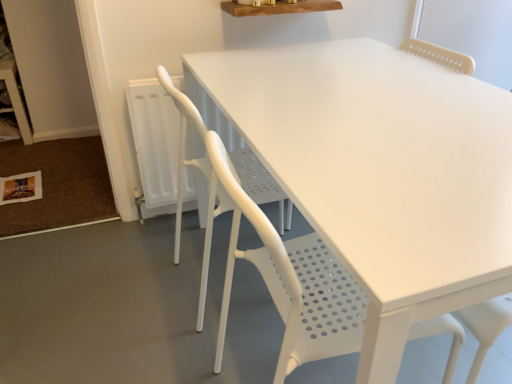
Question: From the image's perspective, is white matte chair at center, the 2th chair from the back, above or below white perforated chair at center, positioned as the second chair in front-to-back order?

Choices:
 (A) below
 (B) above

Answer: (A)

Question: In terms of size, does white matte chair at center, the 2th chair from the back, appear bigger or smaller than white perforated chair at center, positioned as the second chair in front-to-back order?

Choices:
 (A) small
 (B) big

Answer: (A)

Question: Considering the positions of white matte chair at center, the first chair positioned from the front, and white perforated chair at center, positioned as the second chair in front-to-back order, in the image, is white matte chair at center, the first chair positioned from the front, wider or thinner than white perforated chair at center, positioned as the second chair in front-to-back order,?

Choices:
 (A) thin
 (B) wide

Answer: (A)

Question: From the image's perspective, is white perforated chair at center, which is counted as the first chair, starting from the back, positioned above or below white matte chair at center, the 2th chair from the back?

Choices:
 (A) above
 (B) below

Answer: (A)

Question: Is white perforated chair at center, positioned as the second chair in front-to-back order, taller or shorter than white matte chair at center, the first chair positioned from the front?

Choices:
 (A) tall
 (B) short

Answer: (B)

Question: Would you say white perforated chair at center, which is counted as the first chair, starting from the back, is to the left or to the right of white matte chair at center, the 2th chair from the back, in the picture?

Choices:
 (A) right
 (B) left

Answer: (B)

Question: Considering the positions of white perforated chair at center, which is counted as the first chair, starting from the back, and white matte chair at center, the first chair positioned from the front, in the image, is white perforated chair at center, which is counted as the first chair, starting from the back, wider or thinner than white matte chair at center, the first chair positioned from the front,?

Choices:
 (A) thin
 (B) wide

Answer: (B)